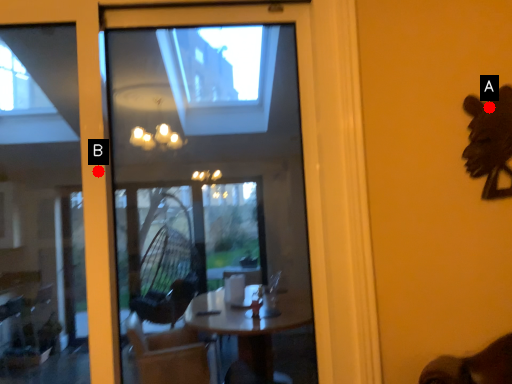
Question: Two points are circled on the image, labeled by A and B beside each circle. Which point appears closest to the camera in this image?

Choices:
 (A) A is closer
 (B) B is closer

Answer: (B)